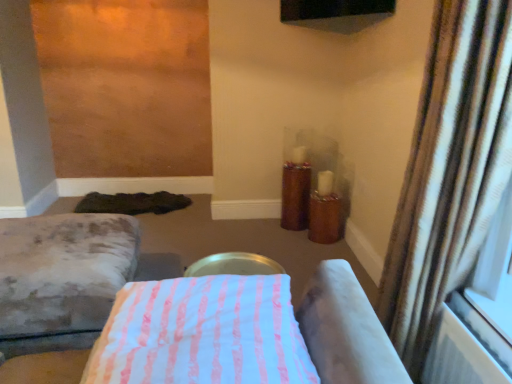
Question: Considering the relative sizes of pink striped fabric at center, the 1th furniture viewed from the front, and velvet gray ottoman at lower left, acting as the first furniture starting from the back, in the image provided, is pink striped fabric at center, the 1th furniture viewed from the front, taller than velvet gray ottoman at lower left, acting as the first furniture starting from the back,?

Choices:
 (A) no
 (B) yes

Answer: (A)

Question: Considering the relative sizes of pink striped fabric at center, the second furniture when ordered from left to right, and velvet gray ottoman at lower left, which is the first furniture from left to right, in the image provided, is pink striped fabric at center, the second furniture when ordered from left to right, smaller than velvet gray ottoman at lower left, which is the first furniture from left to right,?

Choices:
 (A) yes
 (B) no

Answer: (A)

Question: Is pink striped fabric at center, the 2th furniture when ordered from back to front, positioned with its back to velvet gray ottoman at lower left, acting as the second furniture starting from the right?

Choices:
 (A) yes
 (B) no

Answer: (B)

Question: Does pink striped fabric at center, the second furniture when ordered from left to right, have a greater width compared to velvet gray ottoman at lower left, acting as the first furniture starting from the back?

Choices:
 (A) no
 (B) yes

Answer: (A)

Question: Does pink striped fabric at center, the 2th furniture when ordered from back to front, have a larger size compared to velvet gray ottoman at lower left, acting as the second furniture starting from the right?

Choices:
 (A) yes
 (B) no

Answer: (B)

Question: Would you say brown striped curtain at right is inside or outside wooden candle holder at center-right?

Choices:
 (A) inside
 (B) outside

Answer: (B)

Question: From the image's perspective, is brown striped curtain at right positioned above or below wooden candle holder at center-right?

Choices:
 (A) below
 (B) above

Answer: (A)

Question: Considering the positions of brown striped curtain at right and wooden candle holder at center-right in the image, is brown striped curtain at right bigger or smaller than wooden candle holder at center-right?

Choices:
 (A) small
 (B) big

Answer: (B)

Question: Considering the positions of brown striped curtain at right and wooden candle holder at center-right in the image, is brown striped curtain at right taller or shorter than wooden candle holder at center-right?

Choices:
 (A) short
 (B) tall

Answer: (B)

Question: Considering the positions of velvet gray ottoman at lower left, acting as the second furniture starting from the right, and wooden candle holder at center-right in the image, is velvet gray ottoman at lower left, acting as the second furniture starting from the right, wider or thinner than wooden candle holder at center-right?

Choices:
 (A) wide
 (B) thin

Answer: (A)

Question: Visually, is velvet gray ottoman at lower left, acting as the second furniture starting from the right, positioned to the left or to the right of wooden candle holder at center-right?

Choices:
 (A) left
 (B) right

Answer: (A)

Question: Do you think velvet gray ottoman at lower left, which is the first furniture from left to right, is within wooden candle holder at center-right, or outside of it?

Choices:
 (A) inside
 (B) outside

Answer: (B)

Question: From a real-world perspective, is velvet gray ottoman at lower left, acting as the second furniture starting from the right, above or below wooden candle holder at center-right?

Choices:
 (A) below
 (B) above

Answer: (A)

Question: Is wooden candle holder at center-right to the left or to the right of brown striped curtain at right in the image?

Choices:
 (A) right
 (B) left

Answer: (B)

Question: Is wooden candle holder at center-right wider or thinner than brown striped curtain at right?

Choices:
 (A) wide
 (B) thin

Answer: (A)